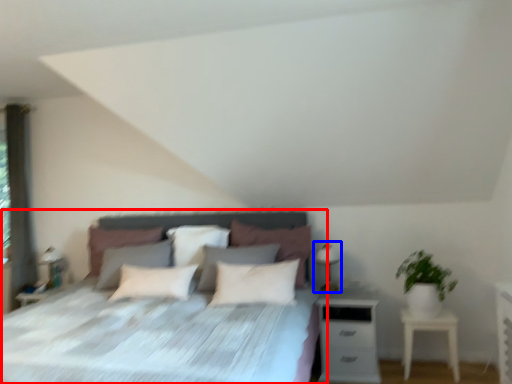
Question: Among these objects, which one is nearest to the camera, bed (highlighted by a red box) or table lamp (highlighted by a blue box)?

Choices:
 (A) bed
 (B) table lamp

Answer: (A)